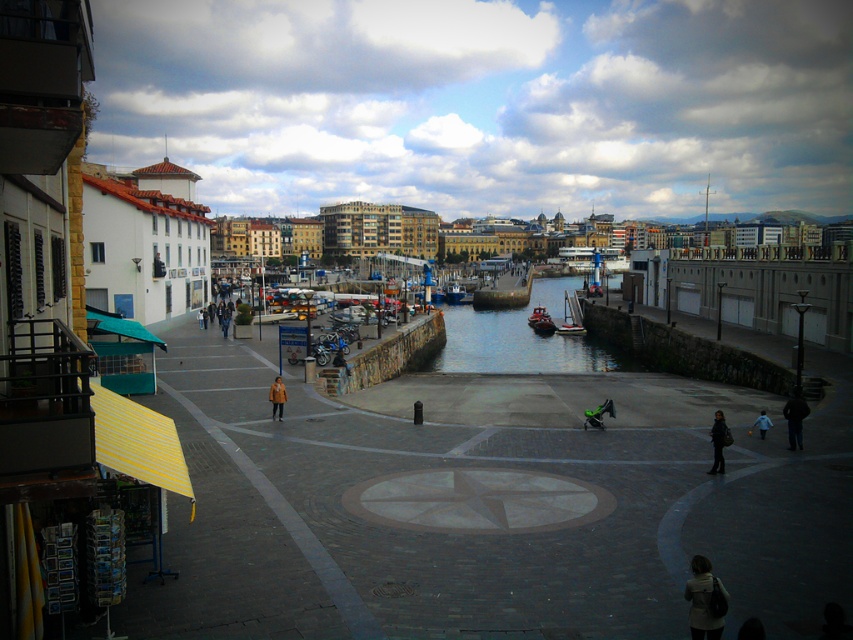
You are standing at the edge of the plaza near the dark brown leather jacket at lower right and want to walk to the clear water at center. Which direction should you head?

You should head to the left because the clear water at center is to the right of dark brown leather jacket at lower right, so moving left from the jacket will lead you toward the water.

You are planning to dock your boat at the marina. You have a boat that is 10 meters wide. The smooth wooden boat at center and the blue metallic boat at center are already docked. Which boat should you avoid to ensure your boat has enough space?

You should avoid the smooth wooden boat at center because its width is larger than the blue metallic boat at center, meaning there might be less space available next to it for your 10 meter wide boat.